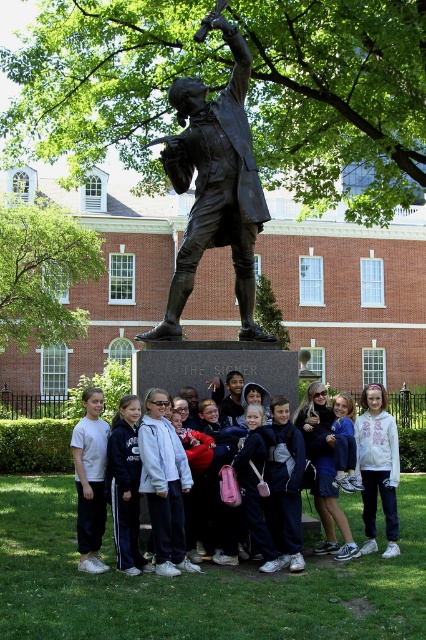
Is the position of bronze statue at center less distant than that of white fleece hoodie at center?

No, bronze statue at center is behind white fleece hoodie at center.

Which is behind, point (253, 218) or point (385, 452)?

Positioned behind is point (253, 218).

Where is `bronze statue at center`? bronze statue at center is located at coordinates (215, 182).

Locate an element on the screen. This screenshot has height=640, width=426. bronze statue at center is located at coordinates (215, 182).

Can you confirm if bronze statue at center is positioned below matte blue hoodie at center?

No, bronze statue at center is not below matte blue hoodie at center.

Is bronze statue at center bigger than matte blue hoodie at center?

Indeed, bronze statue at center has a larger size compared to matte blue hoodie at center.

Is point (209, 240) less distant than point (348, 435)?

No, (209, 240) is further to viewer.

At what (x,y) coordinates should I click in order to perform the action: click on bronze statue at center. Please return your answer as a coordinate pair (x, y). Looking at the image, I should click on (215, 182).

Based on the photo, can you confirm if matte black jacket at center is positioned above matte blue hoodie at center?

Actually, matte black jacket at center is below matte blue hoodie at center.

In the scene shown: Is matte black jacket at center below matte blue hoodie at center?

Yes.

Which is in front, point (299, 452) or point (333, 422)?

Point (299, 452) is in front.

This screenshot has width=426, height=640. What are the coordinates of `matte black jacket at center` in the screenshot? It's located at (327, 465).